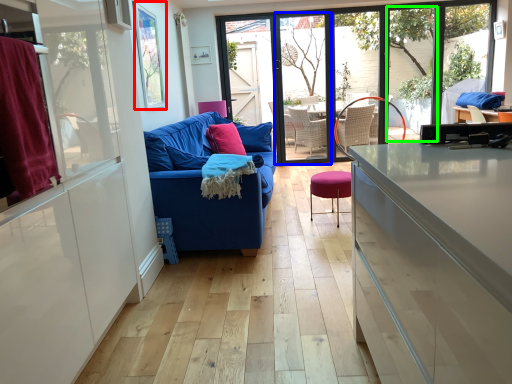
Question: Considering the real-world distances, which object is farthest from window screen (highlighted by a red box)? screen door (highlighted by a blue box) or window (highlighted by a green box)?

Choices:
 (A) screen door
 (B) window

Answer: (B)